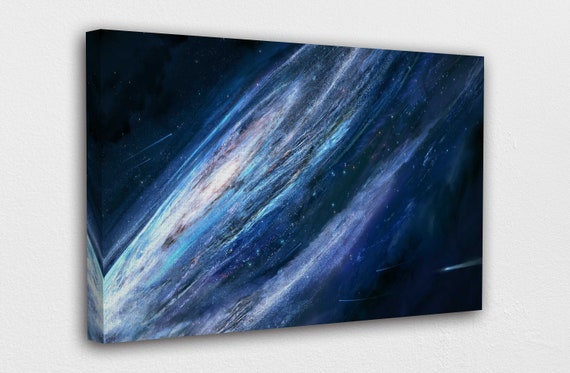
You are a GUI agent. You are given a task and a screenshot of the screen. Output one action in this format:
    pyautogui.click(x=<x>, y=<y>)
    Task: Click on the left edge of paining
    This screenshot has height=373, width=570.
    Given the screenshot: What is the action you would take?
    pyautogui.click(x=97, y=276)